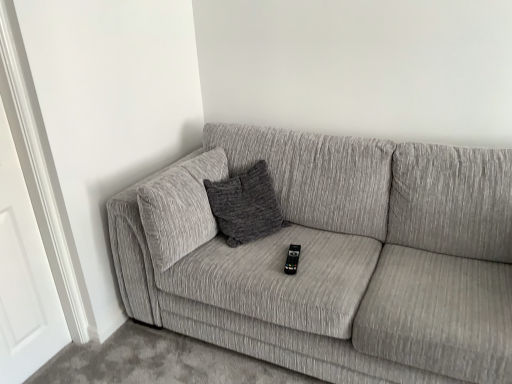
Question: Does point click(293, 269) appear closer or farther from the camera than point click(162, 284)?

Choices:
 (A) farther
 (B) closer

Answer: (B)

Question: Relative to textured gray couch at center, is black plastic remote at center in front or behind?

Choices:
 (A) front
 (B) behind

Answer: (B)

Question: Based on their relative distances, which object is nearer to the black plastic remote at center?

Choices:
 (A) textured gray couch at center
 (B) white wood door at left

Answer: (A)

Question: Based on their relative distances, which object is farther from the white wood door at left?

Choices:
 (A) black plastic remote at center
 (B) textured gray couch at center

Answer: (A)